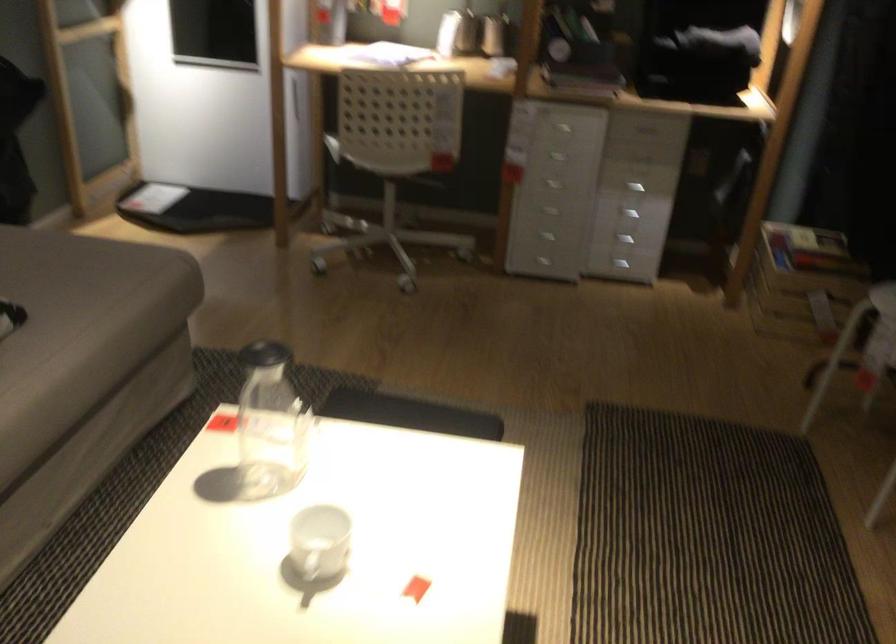
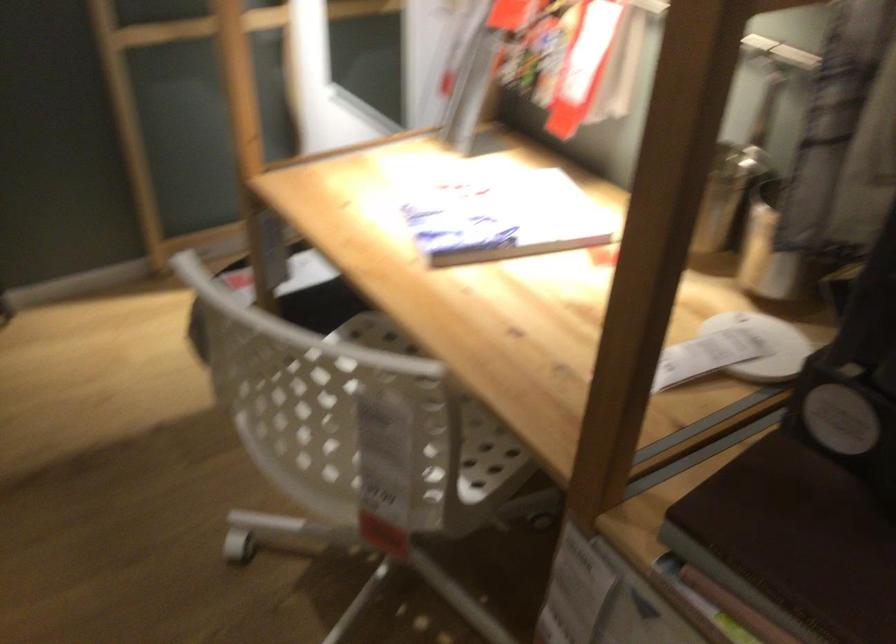
Question: I am providing you with two images of the same scene from different viewpoints. After the viewpoint changes to image2, which objects are now occluded?

Choices:
 (A) metal shaker cup
 (B) dark brown book
 (C) white chair sitting surface
 (D) none of these

Answer: (D)